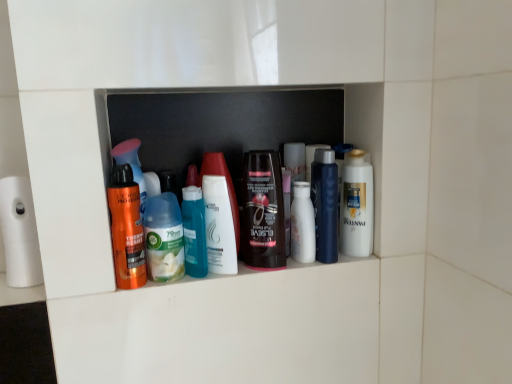
Question: Is translucent plastic bottles at center thinner than shiny orange spray can at left, which is the sixth toiletry in right-to-left order?

Choices:
 (A) no
 (B) yes

Answer: (B)

Question: Would you say translucent plastic bottles at center is a long distance from shiny orange spray can at left, the first toiletry in the left-to-right sequence?

Choices:
 (A) no
 (B) yes

Answer: (A)

Question: Considering the relative positions of translucent plastic bottles at center and shiny orange spray can at left, which is the sixth toiletry in right-to-left order, in the image provided, is translucent plastic bottles at center to the left of shiny orange spray can at left, which is the sixth toiletry in right-to-left order, from the viewer's perspective?

Choices:
 (A) no
 (B) yes

Answer: (A)

Question: Can you confirm if translucent plastic bottles at center is taller than shiny orange spray can at left, which is the sixth toiletry in right-to-left order?

Choices:
 (A) yes
 (B) no

Answer: (A)

Question: Does translucent plastic bottles at center have a larger size compared to shiny orange spray can at left, which is the sixth toiletry in right-to-left order?

Choices:
 (A) yes
 (B) no

Answer: (A)

Question: Can you confirm if translucent plastic bottles at center is positioned to the right of shiny orange spray can at left, which is the sixth toiletry in right-to-left order?

Choices:
 (A) no
 (B) yes

Answer: (B)

Question: Does white glossy lotion at center, which is the second toiletry from right to left, have a larger size compared to translucent plastic bottles at center?

Choices:
 (A) no
 (B) yes

Answer: (A)

Question: Is white glossy lotion at center, the fifth toiletry in the left-to-right sequence, at the left side of translucent plastic bottles at center?

Choices:
 (A) no
 (B) yes

Answer: (A)

Question: Is white glossy lotion at center, which is the second toiletry from right to left, aimed at translucent plastic bottles at center?

Choices:
 (A) yes
 (B) no

Answer: (B)

Question: Does white glossy lotion at center, which is the second toiletry from right to left, have a smaller size compared to translucent plastic bottles at center?

Choices:
 (A) no
 (B) yes

Answer: (B)

Question: Is white glossy lotion at center, which is the second toiletry from right to left, wider than translucent plastic bottles at center?

Choices:
 (A) yes
 (B) no

Answer: (A)

Question: Can we say white matte toilet paper at left lies outside translucent plastic bottles at center?

Choices:
 (A) no
 (B) yes

Answer: (B)